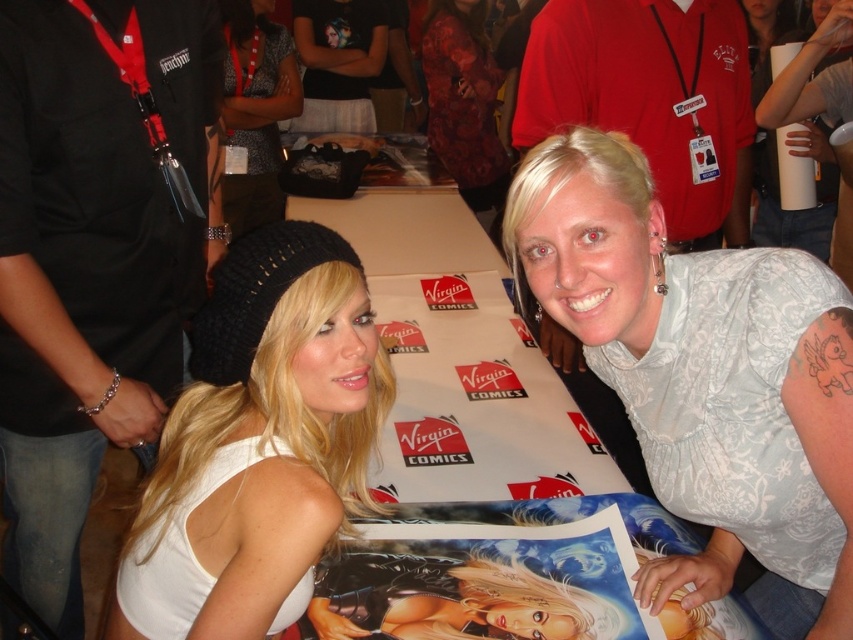
You are an attendee at the convention and want to take a photo of both the white lace blouse at center and the black knit beanie at upper left. Can you frame both in the same shot without moving either item?

The white lace blouse at center is not as tall as the black knit beanie at upper left, so it might be challenging to frame both in the same shot without moving either item since the black knit beanie at upper left is taller.

In the scene shown: You are a photographer at the event and want to take a picture of the black knit beanie at upper left. Where should you focus your camera to capture it accurately?

The black knit beanie at upper left is located at point 0.172 on the horizontal axis and 0.300 on the vertical axis, so focus your camera there.

You are attending a comic convention and want to locate the person wearing the white knit beanie at upper left. Based on the coordinate system where the bottom left corner is the origin, can you determine if this beanie is closer to the top or bottom of the image?

The white knit beanie at upper left is located at coordinate y value 0.308, which is closer to the bottom of the image since the coordinate system starts at the bottom left corner.